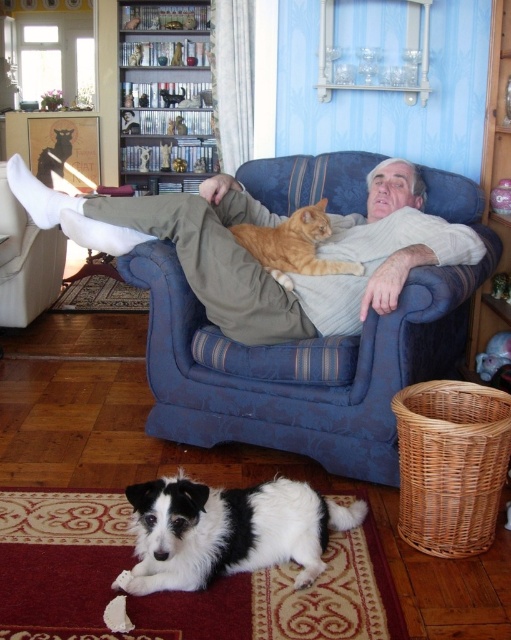
Between blue fabric couch at center and orange fur cat at center, which one is positioned higher?

orange fur cat at center is above.

Who is shorter, blue fabric couch at center or orange fur cat at center?

With less height is orange fur cat at center.

What do you see at coordinates (310, 356) in the screenshot? I see `blue fabric couch at center` at bounding box center [310, 356].

Identify the location of blue fabric couch at center. The width and height of the screenshot is (511, 640). (310, 356).

Is point (336, 225) more distant than point (311, 236)?

Yes.

Who is higher up, white knit sweater at center or orange fur cat at center?

Positioned higher is white knit sweater at center.

Locate an element on the screen. white knit sweater at center is located at coordinates (257, 260).

Does black-and-white fur dog at lower center appear over orange fur cat at center?

Actually, black-and-white fur dog at lower center is below orange fur cat at center.

Based on the photo, does black-and-white fur dog at lower center appear on the right side of orange fur cat at center?

No, black-and-white fur dog at lower center is not to the right of orange fur cat at center.

Is point (195, 540) closer to camera compared to point (243, 236)?

Yes.

Find the location of a particular element. The image size is (511, 640). black-and-white fur dog at lower center is located at coordinates (227, 531).